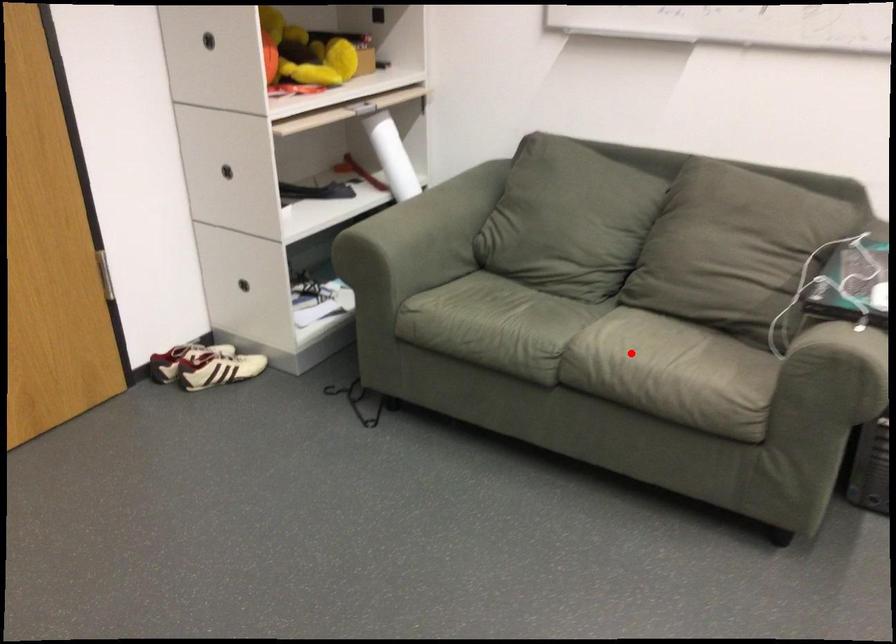
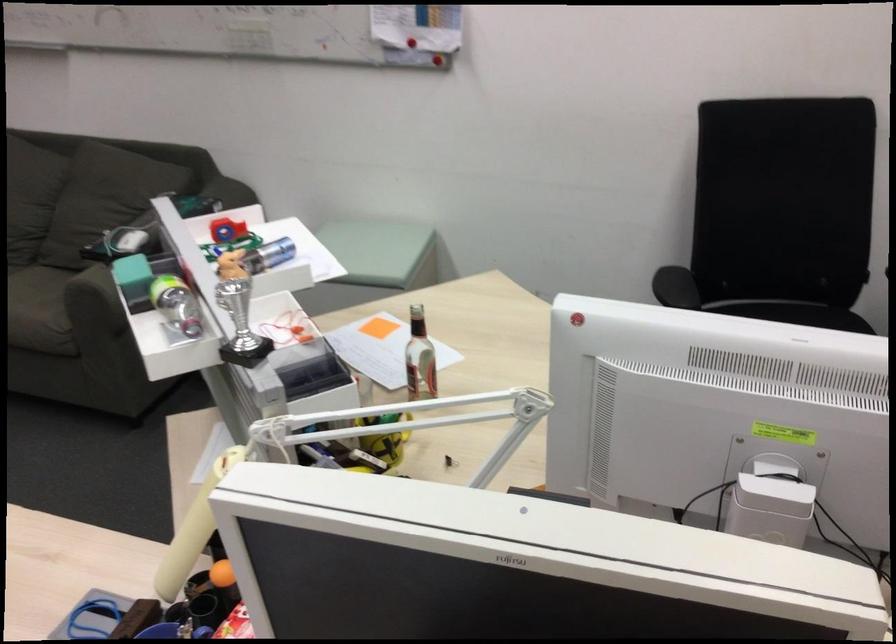
Locate, in the second image, the point that corresponds to the highlighted location in the first image.

(39, 308)